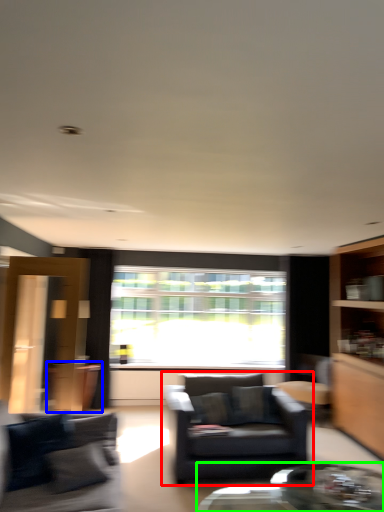
Question: Estimate the real-world distances between objects in this image. Which object is closer to chair (highlighted by a red box), cabinetry (highlighted by a blue box) or coffee table (highlighted by a green box)?

Choices:
 (A) cabinetry
 (B) coffee table

Answer: (B)